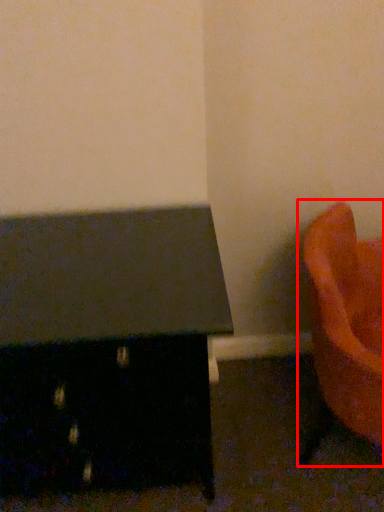
Question: Where is furniture (annotated by the red box) located in relation to furniture in the image?

Choices:
 (A) left
 (B) right

Answer: (B)